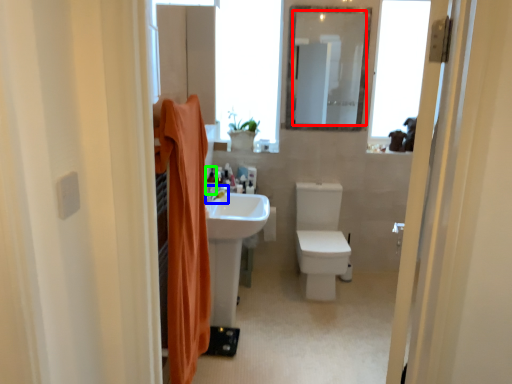
Question: Estimate the real-world distances between objects in this image. Which object is farther from mirror (highlighted by a red box), tap (highlighted by a blue box) or toiletry (highlighted by a green box)?

Choices:
 (A) tap
 (B) toiletry

Answer: (A)